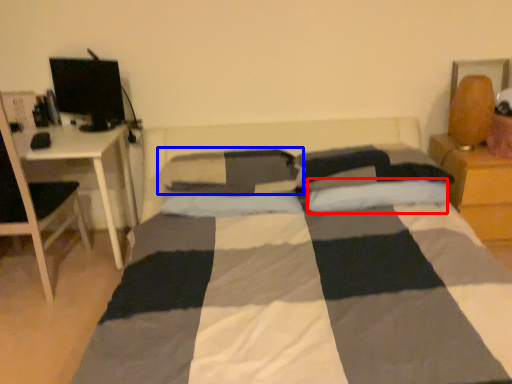
Question: Which point is further to the camera, pillow (highlighted by a red box) or pillow (highlighted by a blue box)?

Choices:
 (A) pillow
 (B) pillow

Answer: (B)